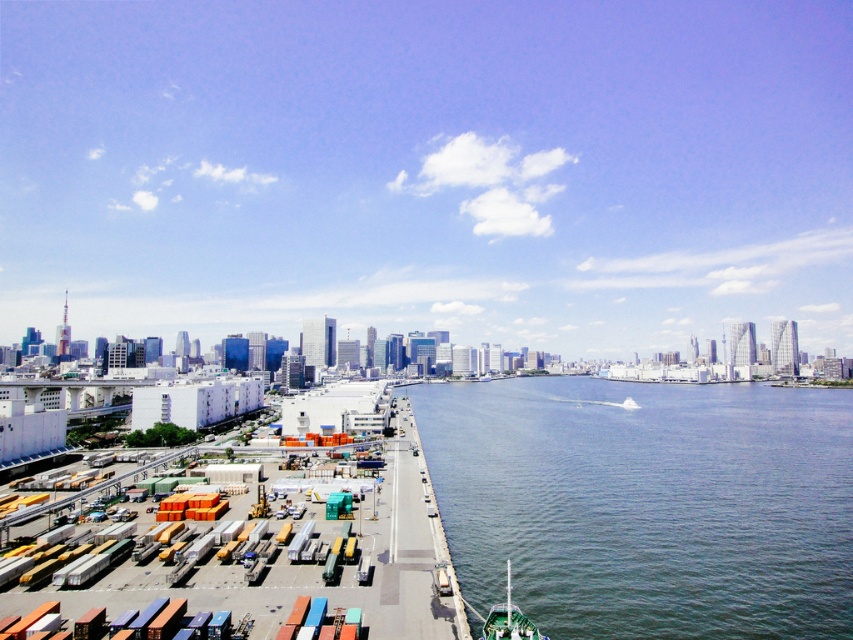
Is white matte dock at lower left to the left of green matte boat at lower right from the viewer's perspective?

Correct, you'll find white matte dock at lower left to the left of green matte boat at lower right.

Who is taller, white matte dock at lower left or green matte boat at lower right?

With more height is white matte dock at lower left.

Is point (71, 595) positioned before point (492, 609)?

That is True.

You are a GUI agent. You are given a task and a screenshot of the screen. Output one action in this format:
    pyautogui.click(x=<x>, y=<y>)
    Task: Click on the white matte dock at lower left
    The image size is (853, 640).
    Given the screenshot: What is the action you would take?
    tap(270, 563)

Which is more to the left, clear water at center or white matte dock at lower left?

From the viewer's perspective, white matte dock at lower left appears more on the left side.

Which of these two, clear water at center or white matte dock at lower left, stands shorter?

Standing shorter between the two is clear water at center.

Between point (498, 477) and point (91, 604), which one is positioned in front?

Point (91, 604)

You are a GUI agent. You are given a task and a screenshot of the screen. Output one action in this format:
    pyautogui.click(x=<x>, y=<y>)
    Task: Click on the clear water at center
    
    Given the screenshot: What is the action you would take?
    pyautogui.click(x=647, y=504)

Is point (578, 465) closer to viewer compared to point (506, 564)?

That is False.

Is clear water at center to the right of green matte boat at lower right from the viewer's perspective?

Indeed, clear water at center is positioned on the right side of green matte boat at lower right.

I want to click on clear water at center, so click(647, 504).

What are the coordinates of `clear water at center` in the screenshot? It's located at (647, 504).